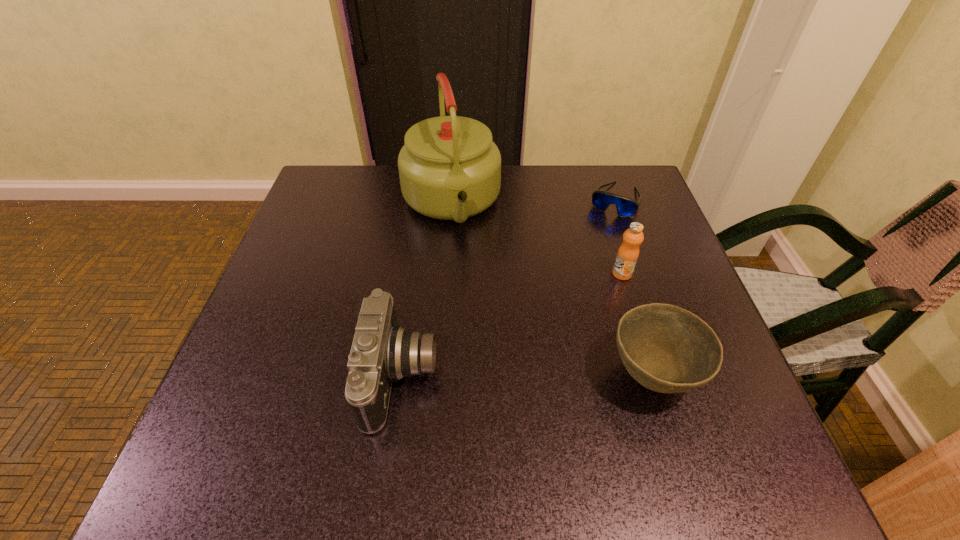
Locate an element on the screen. This screenshot has width=960, height=540. unoccupied area between the sunglasses and the third nearest object is located at coordinates (618, 237).

Identify which object is the third nearest to the third nearest object. Please provide its 2D coordinates. Your answer should be formatted as a tuple, i.e. [(x, y)], where the tuple contains the x and y coordinates of a point satisfying the conditions above.

[(449, 168)]

The image size is (960, 540). I want to click on object that ranks as the fourth closest to the orange juice, so click(382, 351).

Where is `free space that satisfies the following two spatial constraints: 1. on the back side of the third nearest object; 2. on the right side of the shortest object`? This screenshot has height=540, width=960. free space that satisfies the following two spatial constraints: 1. on the back side of the third nearest object; 2. on the right side of the shortest object is located at coordinates (599, 200).